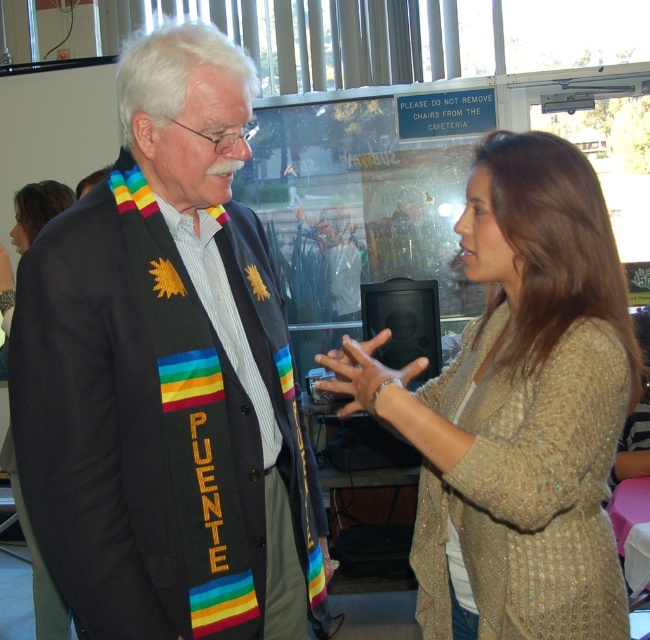
Is sparkly beige cardigan at center wider than shiny gold necklace at upper left?

Yes, sparkly beige cardigan at center is wider than shiny gold necklace at upper left.

Does sparkly beige cardigan at center appear over shiny gold necklace at upper left?

Indeed, sparkly beige cardigan at center is positioned over shiny gold necklace at upper left.

This screenshot has height=640, width=650. I want to click on sparkly beige cardigan at center, so click(517, 406).

Where is `sparkly beige cardigan at center`? sparkly beige cardigan at center is located at coordinates (517, 406).

Can you confirm if matte black suit at center is positioned below shiny gold necklace at upper left?

No.

Between matte black suit at center and shiny gold necklace at upper left, which one has more height?

matte black suit at center is taller.

Measure the distance between matte black suit at center and camera.

matte black suit at center is 4.12 feet away from camera.

Find the location of a particular element. matte black suit at center is located at coordinates (166, 376).

Who is shorter, matte black suit at center or sparkly beige cardigan at center?

Standing shorter between the two is sparkly beige cardigan at center.

Who is positioned more to the right, matte black suit at center or sparkly beige cardigan at center?

From the viewer's perspective, sparkly beige cardigan at center appears more on the right side.

The width and height of the screenshot is (650, 640). What do you see at coordinates (166, 376) in the screenshot? I see `matte black suit at center` at bounding box center [166, 376].

In order to click on matte black suit at center in this screenshot , I will do `click(166, 376)`.